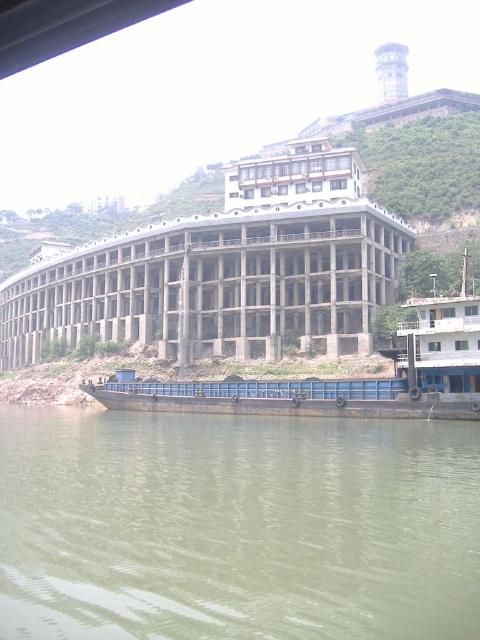
Question: Which of the following is the closest to the observer?

Choices:
 (A) (36, 499)
 (B) (454, 358)

Answer: (A)

Question: Is green murky water at lower center thinner than rusty metal barge at lower right?

Choices:
 (A) no
 (B) yes

Answer: (B)

Question: Does green murky water at lower center appear on the right side of rusty metal barge at lower right?

Choices:
 (A) yes
 (B) no

Answer: (B)

Question: Can you confirm if green murky water at lower center is positioned to the left of rusty metal barge at lower right?

Choices:
 (A) no
 (B) yes

Answer: (B)

Question: Which object is closer to the camera taking this photo?

Choices:
 (A) green murky water at lower center
 (B) rusty metal barge at lower right

Answer: (A)